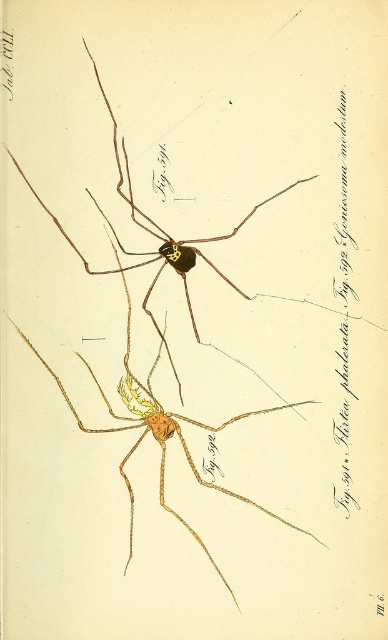
Who is positioned more to the right, golden-brown matte spider at bottom left or black paper text at right?

From the viewer's perspective, black paper text at right appears more on the right side.

At what (x,y) coordinates should I click in order to perform the action: click on golden-brown matte spider at bottom left. Please return your answer as a coordinate pair (x, y). The width and height of the screenshot is (388, 640). Looking at the image, I should click on (159, 435).

Who is more distant from viewer, (x=162, y=486) or (x=342, y=401)?

Positioned behind is point (x=342, y=401).

Where is `golden-brown matte spider at bottom left`? The height and width of the screenshot is (640, 388). golden-brown matte spider at bottom left is located at coordinates (159, 435).

Based on the photo, who is shorter, golden-brown matte spider at bottom left or brown matte spider at center?

Standing shorter between the two is golden-brown matte spider at bottom left.

Is golden-brown matte spider at bottom left behind brown matte spider at center?

No, golden-brown matte spider at bottom left is in front of brown matte spider at center.

The height and width of the screenshot is (640, 388). I want to click on golden-brown matte spider at bottom left, so click(x=159, y=435).

Identify the location of golden-brown matte spider at bottom left. This screenshot has width=388, height=640. (159, 435).

Is brown matte spider at center wider than black paper text at right?

Indeed, brown matte spider at center has a greater width compared to black paper text at right.

Between brown matte spider at center and black paper text at right, which one appears on the right side from the viewer's perspective?

Positioned to the right is black paper text at right.

What do you see at coordinates (154, 236) in the screenshot?
I see `brown matte spider at center` at bounding box center [154, 236].

I want to click on brown matte spider at center, so click(154, 236).